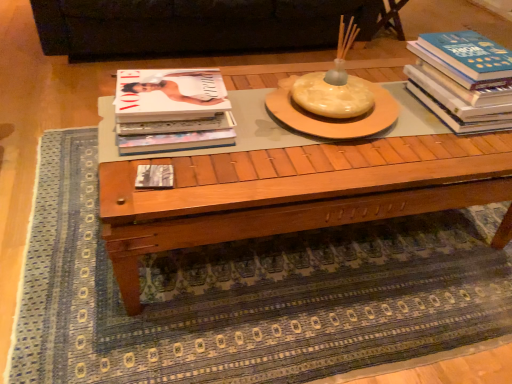
Locate an element on the screen. The height and width of the screenshot is (384, 512). vacant space in front of matte black book at center, arranged as the first book when viewed from the left is located at coordinates (142, 204).